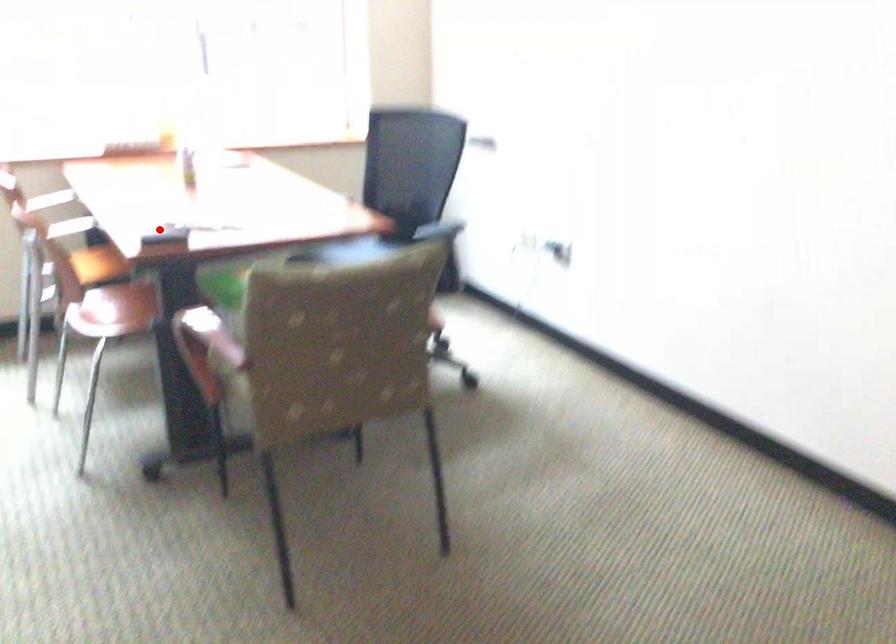
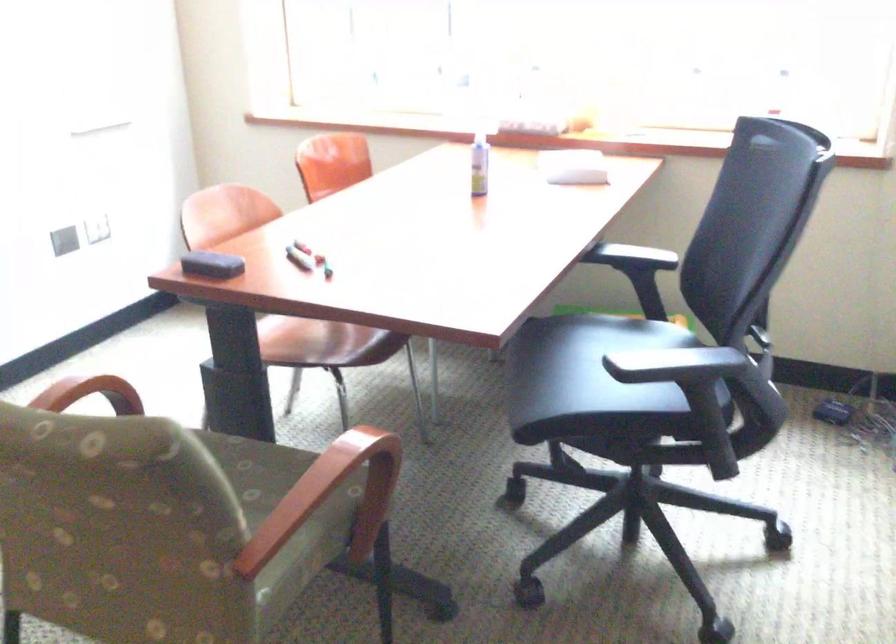
Question: I am providing you with two images of the same scene from different viewpoints. Given a red point in image1, look at the same physical point in image2. Is it:

Choices:
 (A) Closer to the viewpoint
 (B) Farther from the viewpoint

Answer: (A)